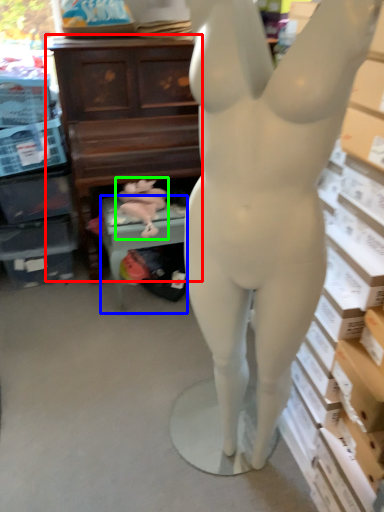
Question: Which object is positioned closest to entertainment center (highlighted by a red box)? Select from furniture (highlighted by a blue box) and animal sculpture (highlighted by a green box).

Choices:
 (A) furniture
 (B) animal sculpture

Answer: (B)